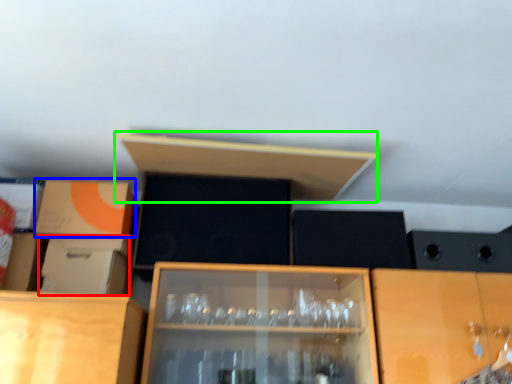
Question: Estimate the real-world distances between objects in this image. Which object is farther from cardboard box (highlighted by a red box), cardboard box (highlighted by a blue box) or shelf (highlighted by a green box)?

Choices:
 (A) cardboard box
 (B) shelf

Answer: (B)